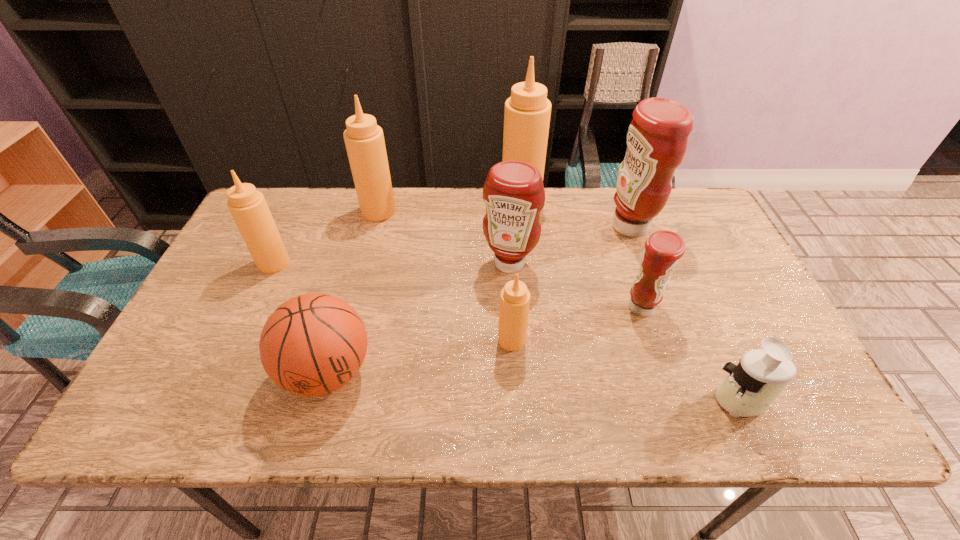
Locate which object ranks fifth in proximity to the second biggest red condiment. Please provide its 2D coordinates. Your answer should be formatted as a tuple, i.e. [(x, y)], where the tuple contains the x and y coordinates of a point satisfying the conditions above.

[(364, 140)]

Locate which object ranks fourth in proximity to the smallest red condiment. Please provide its 2D coordinates. Your answer should be formatted as a tuple, i.e. [(x, y)], where the tuple contains the x and y coordinates of a point satisfying the conditions above.

[(515, 297)]

At what (x,y) coordinates should I click in order to perform the action: click on condiment that can be found as the sixth closest to the second biggest red condiment. Please return your answer as a coordinate pair (x, y). The height and width of the screenshot is (540, 960). Looking at the image, I should click on (248, 207).

Where is `condiment that can be found as the sixth closest to the second nearest condiment`? condiment that can be found as the sixth closest to the second nearest condiment is located at coordinates (248, 207).

At what (x,y) coordinates should I click in order to perform the action: click on tan condiment that is the third closest one to the second tan condiment from left to right. Please return your answer as a coordinate pair (x, y). This screenshot has height=540, width=960. Looking at the image, I should click on (515, 297).

Select which tan condiment appears as the closest to the nearest tan condiment. Please provide its 2D coordinates. Your answer should be formatted as a tuple, i.e. [(x, y)], where the tuple contains the x and y coordinates of a point satisfying the conditions above.

[(527, 113)]

Select which red condiment is the closest to the juicer. Please provide its 2D coordinates. Your answer should be formatted as a tuple, i.e. [(x, y)], where the tuple contains the x and y coordinates of a point satisfying the conditions above.

[(663, 249)]

Choose which red condiment is the second nearest neighbor to the second biggest red condiment. Please provide its 2D coordinates. Your answer should be formatted as a tuple, i.e. [(x, y)], where the tuple contains the x and y coordinates of a point satisfying the conditions above.

[(657, 137)]

Locate an element on the screen. free space that satisfies the following two spatial constraints: 1. on the front side of the second biggest red condiment; 2. on the left side of the third biggest tan condiment is located at coordinates (274, 263).